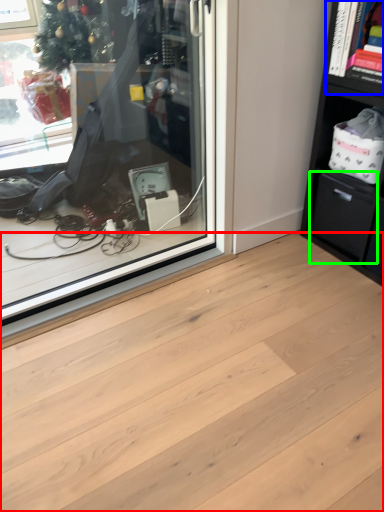
Question: Considering the real-world distances, which object is closest to plank (highlighted by a red box)? cabinet (highlighted by a blue box) or drawer (highlighted by a green box).

Choices:
 (A) cabinet
 (B) drawer

Answer: (B)